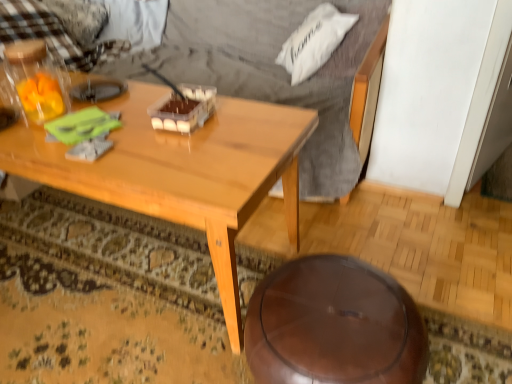
Identify the location of free space above shiny brown stool at lower center (from a real-world perspective). The image size is (512, 384). (337, 306).